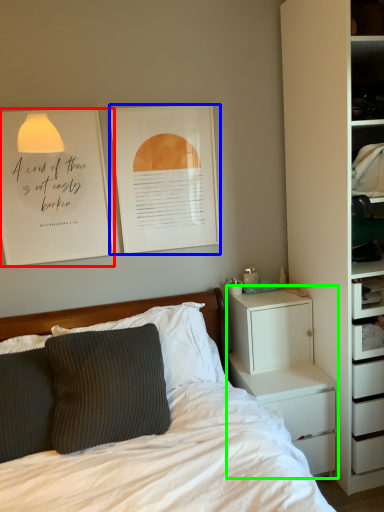
Question: Based on their relative distances, which object is farther from bulletin board (highlighted by a red box)? Choose from picture frame (highlighted by a blue box) and chest of drawers (highlighted by a green box).

Choices:
 (A) picture frame
 (B) chest of drawers

Answer: (B)